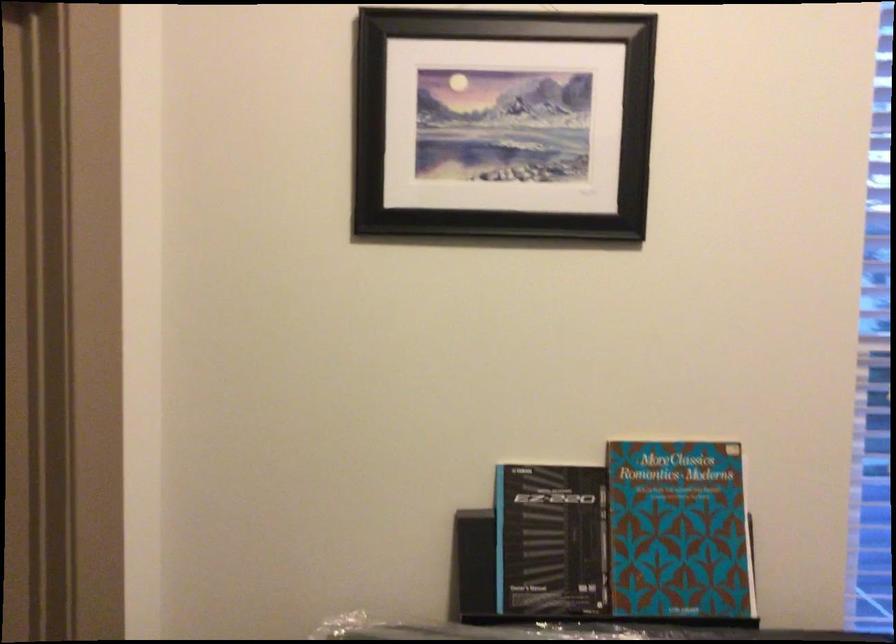
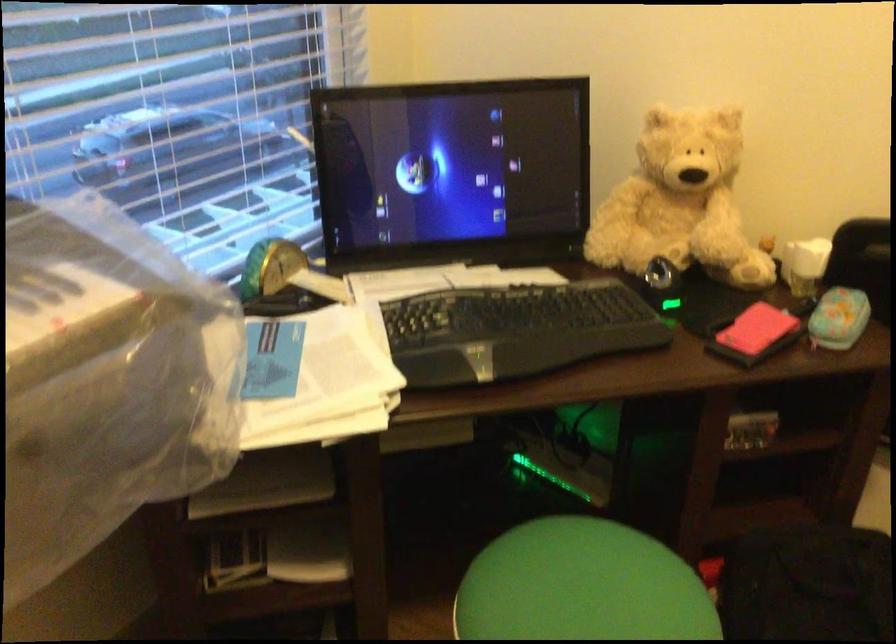
How did the camera likely rotate?

The rotation direction of the camera is right-down.